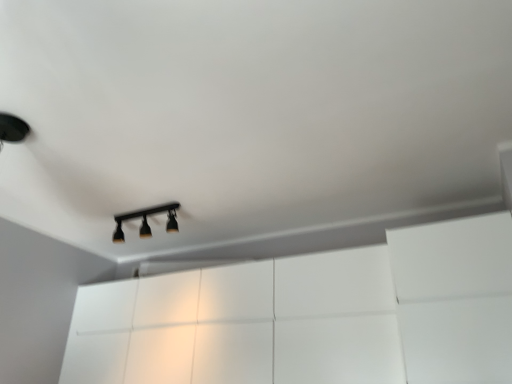
Question: Does black matte track light at center have a lesser height compared to white glossy dresser at center?

Choices:
 (A) yes
 (B) no

Answer: (A)

Question: Is black matte track light at center wider than white glossy dresser at center?

Choices:
 (A) yes
 (B) no

Answer: (B)

Question: From the image's perspective, is black matte track light at center above white glossy dresser at center?

Choices:
 (A) no
 (B) yes

Answer: (B)

Question: Is black matte track light at center to the right of white glossy dresser at center from the viewer's perspective?

Choices:
 (A) no
 (B) yes

Answer: (A)

Question: Is black matte track light at center positioned in front of white glossy dresser at center?

Choices:
 (A) no
 (B) yes

Answer: (A)

Question: Is black matte track light at center at the left side of white glossy dresser at center?

Choices:
 (A) no
 (B) yes

Answer: (B)

Question: From the image's perspective, is white glossy dresser at center below black matte track light at center?

Choices:
 (A) yes
 (B) no

Answer: (A)

Question: Is white glossy dresser at center positioned with its back to black matte track light at center?

Choices:
 (A) yes
 (B) no

Answer: (B)

Question: Does white glossy dresser at center lie in front of black matte track light at center?

Choices:
 (A) no
 (B) yes

Answer: (B)

Question: From a real-world perspective, is white glossy dresser at center over black matte track light at center?

Choices:
 (A) yes
 (B) no

Answer: (B)

Question: Considering the relative positions of white glossy dresser at center and black matte track light at center in the image provided, is white glossy dresser at center to the right of black matte track light at center from the viewer's perspective?

Choices:
 (A) no
 (B) yes

Answer: (B)

Question: Could you tell me if white glossy dresser at center is facing black matte track light at center?

Choices:
 (A) no
 (B) yes

Answer: (A)

Question: Relative to black matte track light at center, is white glossy dresser at center in front or behind?

Choices:
 (A) front
 (B) behind

Answer: (A)